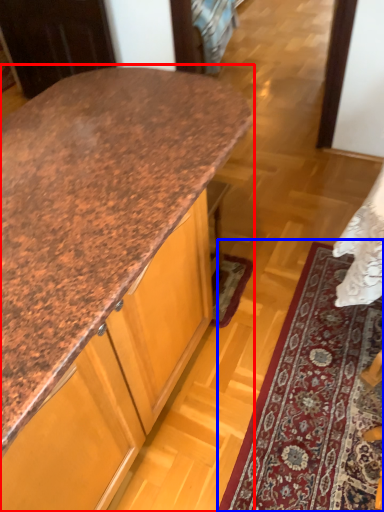
Question: Which object is closer to the camera taking this photo, countertop (highlighted by a red box) or mat (highlighted by a blue box)?

Choices:
 (A) countertop
 (B) mat

Answer: (A)